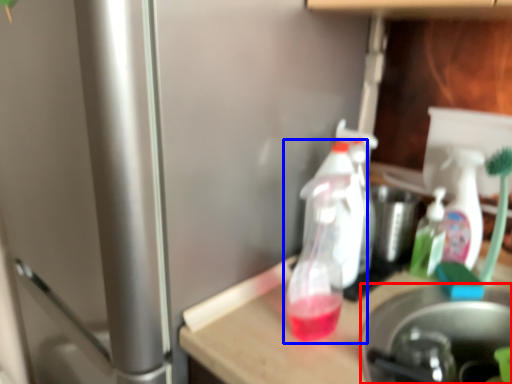
Question: Among these objects, which one is nearest to the camera, appliance (highlighted by a red box) or bottle (highlighted by a blue box)?

Choices:
 (A) appliance
 (B) bottle

Answer: (A)